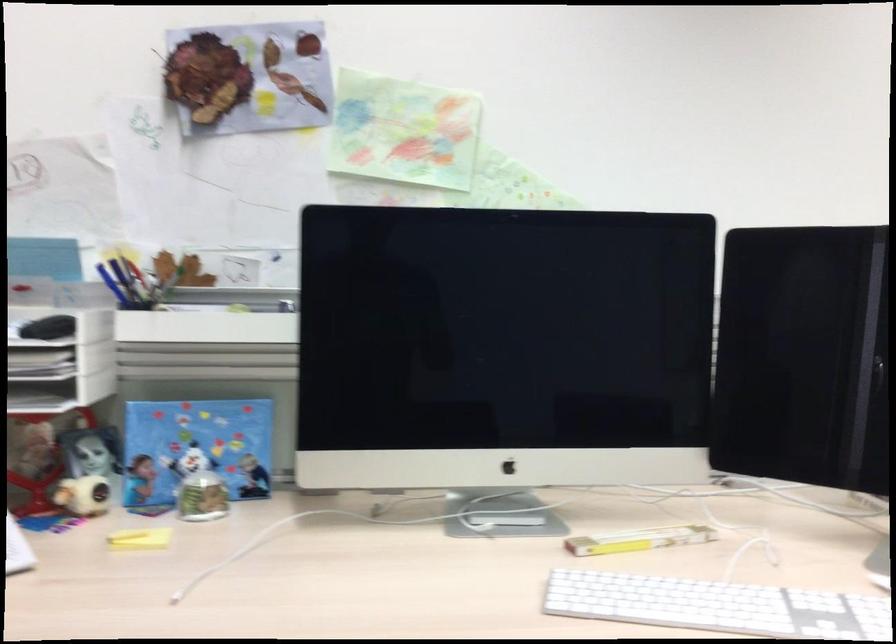
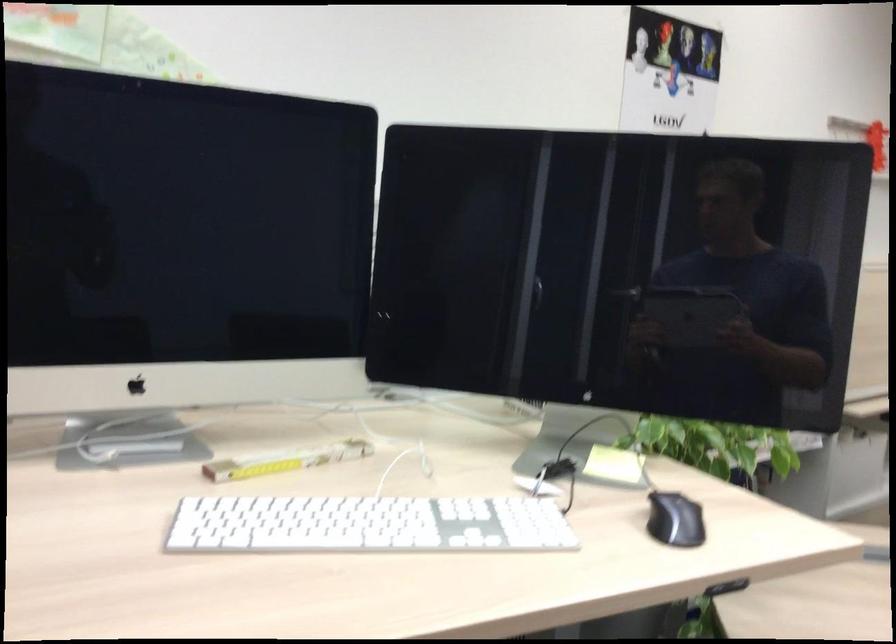
Question: Based on the continuous images, in which direction is the camera rotating? Reply with the corresponding letter.

Choices:
 (A) Left
 (B) Right
 (C) Up
 (D) Down

Answer: (B)